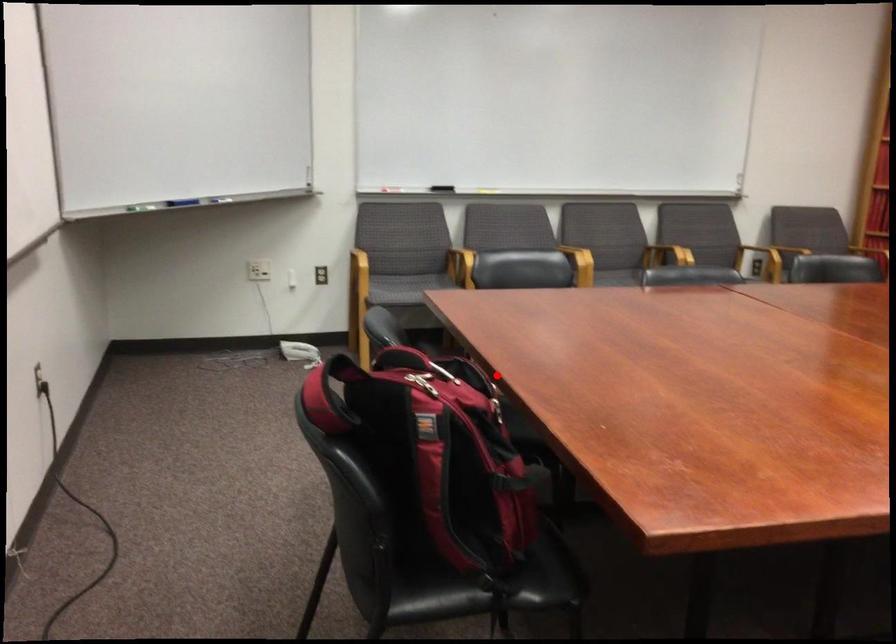
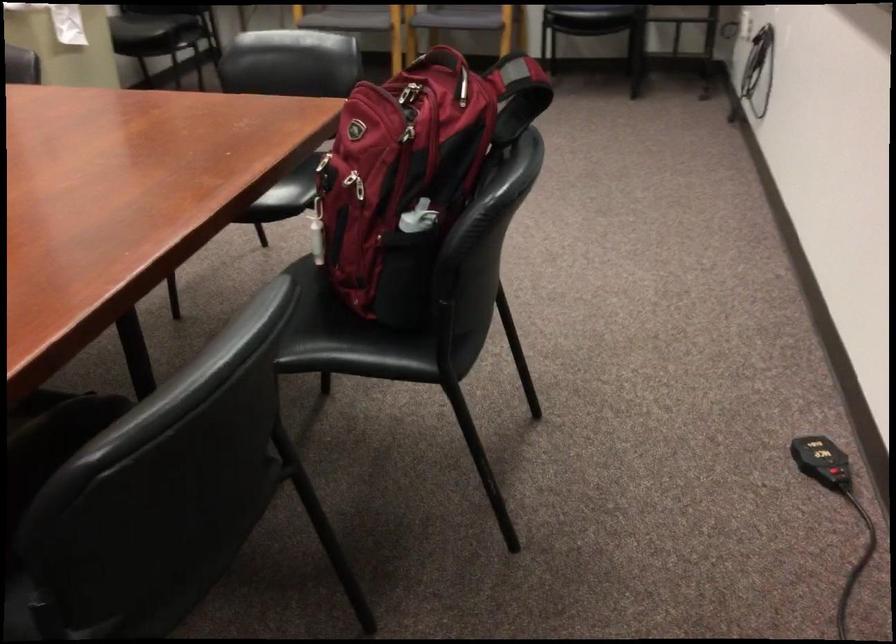
Question: I am providing you with two images of the same scene from different viewpoints. A red point is marked on the first image. Is the red point's position out of view in image 2?

Choices:
 (A) Yes
 (B) No

Answer: (B)